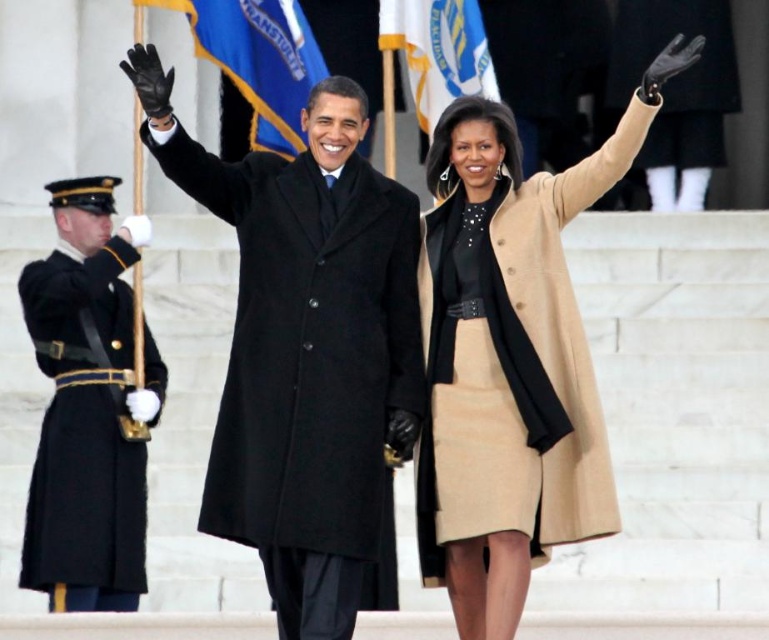
Based on the scene description, what is located at the coordinates point (305, 346)?

The black wool coat at center is located at point (305, 346).

You are a photographer at a formal event. You need to capture a photo where the black wool uniform at left and the black leather glove at upper center are both clearly visible. Based on their positions, which object is lower in the image?

The black wool uniform at left is below the black leather glove at upper center, so the black wool uniform at left is lower in the image.

You are a photographer at the event and need to capture a photo where both the black wool coat at center and the beige wool coat at center are clearly visible. Based on their positions, which coat should you focus on first to ensure the other remains in the frame?

The black wool coat at center is below the beige wool coat at center, so you should focus on the beige wool coat at center first to ensure the lower positioned black wool coat at center stays within the frame.